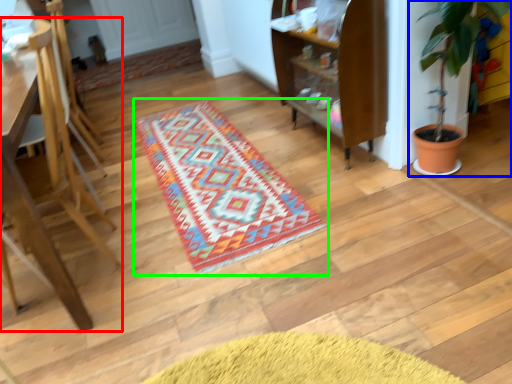
Question: Which is nearer to the furniture (highlighted by a red box)? houseplant (highlighted by a blue box) or mat (highlighted by a green box).

Choices:
 (A) houseplant
 (B) mat

Answer: (B)